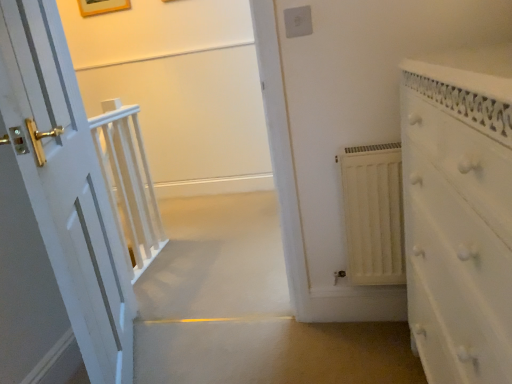
What is the approximate width of wooden picture frame at upper center?

The width of wooden picture frame at upper center is 0.99 inches.

Identify the location of white matte radiator at center right. Image resolution: width=512 pixels, height=384 pixels. (373, 214).

Looking at this image, from a real-world perspective, which is physically below, white matte radiator at center right or white plastic electric outlet at upper center?

In real-world perspective, white matte radiator at center right is lower.

Is white matte radiator at center right positioned behind white plastic electric outlet at upper center?

That is False.

Does point (357, 201) come farther from viewer compared to point (291, 21)?

Yes, it is behind point (291, 21).

In terms of size, does white matte radiator at center right appear bigger or smaller than white plastic electric outlet at upper center?

Clearly, white matte radiator at center right is larger in size than white plastic electric outlet at upper center.

Looking at the image, does white textured dresser at right seem bigger or smaller compared to white matte radiator at center right?

white textured dresser at right is bigger than white matte radiator at center right.

Is white textured dresser at right next to white matte radiator at center right and touching it?

No, white textured dresser at right is not with white matte radiator at center right.

Considering the positions of point (470, 272) and point (370, 188), is point (470, 272) closer or farther from the camera than point (370, 188)?

Clearly, point (470, 272) is closer to the camera than point (370, 188).

How different are the orientations of white textured dresser at right and white matte radiator at center right in degrees?

The facing directions of white textured dresser at right and white matte radiator at center right are 90.9 degrees apart.

Is white plastic electric outlet at upper center located outside white matte radiator at center right?

Indeed, white plastic electric outlet at upper center is completely outside white matte radiator at center right.

Relative to white matte radiator at center right, is white plastic electric outlet at upper center in front or behind?

Visually, white plastic electric outlet at upper center is located behind white matte radiator at center right.

Is white plastic electric outlet at upper center not near white matte radiator at center right?

No, white plastic electric outlet at upper center is in close proximity to white matte radiator at center right.

Who is taller, white plastic electric outlet at upper center or white matte radiator at center right?

white matte radiator at center right is taller.

Would you consider white textured dresser at right to be distant from white plastic electric outlet at upper center?

No, there isn't a large distance between white textured dresser at right and white plastic electric outlet at upper center.

Considering the positions of points (459, 189) and (303, 29), is point (459, 189) closer to camera compared to point (303, 29)?

Yes, it is in front of point (303, 29).

Is white textured dresser at right turned away from white plastic electric outlet at upper center?

white textured dresser at right is not turned away from white plastic electric outlet at upper center.

From a real-world perspective, between white wooden balustrade at center and white plastic electric outlet at upper center, who is vertically higher?

In real-world perspective, white plastic electric outlet at upper center is above.

Between white wooden balustrade at center and white plastic electric outlet at upper center, which one has larger size?

white wooden balustrade at center.

Where is `electric outlet that is in front of the white wooden balustrade at center`? This screenshot has width=512, height=384. electric outlet that is in front of the white wooden balustrade at center is located at coordinates (298, 21).

Considering their positions, is white wooden balustrade at center located in front of or behind white plastic electric outlet at upper center?

white wooden balustrade at center is behind white plastic electric outlet at upper center.

Image resolution: width=512 pixels, height=384 pixels. In order to click on balustrade behind the white matte radiator at center right in this screenshot , I will do `click(128, 182)`.

Between white matte radiator at center right and white wooden balustrade at center, which one has smaller size?

white matte radiator at center right.

Can you confirm if white matte radiator at center right is positioned to the right of white wooden balustrade at center?

Correct, you'll find white matte radiator at center right to the right of white wooden balustrade at center.

Is the depth of white matte radiator at center right less than that of white wooden balustrade at center?

Yes, white matte radiator at center right is closer to the viewer.

Is point (123, 183) positioned behind point (366, 234)?

Yes, point (123, 183) is behind point (366, 234).

Does white wooden balustrade at center have a greater height compared to white matte radiator at center right?

Correct, white wooden balustrade at center is much taller as white matte radiator at center right.

Who is smaller, white wooden balustrade at center or white matte radiator at center right?

white matte radiator at center right is smaller.

Is white wooden balustrade at center placed right next to white matte radiator at center right?

white wooden balustrade at center is not next to white matte radiator at center right, and they're not touching.

The height and width of the screenshot is (384, 512). I want to click on radiator below the white plastic electric outlet at upper center (from the image's perspective), so click(373, 214).

Where is `radiator that appears above the white textured dresser at right (from the image's perspective)`? radiator that appears above the white textured dresser at right (from the image's perspective) is located at coordinates (373, 214).

Looking at the image, which one is located further to white plastic electric outlet at upper center, white textured dresser at right or white matte radiator at center right?

Based on the image, white textured dresser at right appears to be further to white plastic electric outlet at upper center.

When comparing their distances from white matte radiator at center right, does white plastic electric outlet at upper center or white wooden balustrade at center seem further?

white wooden balustrade at center is further to white matte radiator at center right.

Looking at the image, which one is located closer to wooden picture frame at upper center, white textured dresser at right or white plastic electric outlet at upper center?

white plastic electric outlet at upper center.

Based on their spatial positions, is white matte radiator at center right or white wooden balustrade at center closer to white textured dresser at right?

Based on the image, white matte radiator at center right appears to be nearer to white textured dresser at right.

Considering their positions, is white textured dresser at right positioned further to wooden picture frame at upper center than white matte radiator at center right?

white textured dresser at right is positioned further to the anchor wooden picture frame at upper center.

Which object lies further to the anchor point white matte radiator at center right, white textured dresser at right or white wooden balustrade at center?

Among the two, white wooden balustrade at center is located further to white matte radiator at center right.

Based on their spatial positions, is wooden picture frame at upper center or white textured dresser at right closer to white plastic electric outlet at upper center?

The object closer to white plastic electric outlet at upper center is white textured dresser at right.

Which object lies nearer to the anchor point white wooden balustrade at center, white matte radiator at center right or white textured dresser at right?

Among the two, white matte radiator at center right is located nearer to white wooden balustrade at center.

The image size is (512, 384). Find the location of `electric outlet between white textured dresser at right and white wooden balustrade at center along the z-axis`. electric outlet between white textured dresser at right and white wooden balustrade at center along the z-axis is located at coordinates (298, 21).

You are a GUI agent. You are given a task and a screenshot of the screen. Output one action in this format:
    pyautogui.click(x=<x>, y=<y>)
    Task: Click on the balustrade that lies between wooden picture frame at upper center and white matte radiator at center right from top to bottom
    The height and width of the screenshot is (384, 512).
    Given the screenshot: What is the action you would take?
    pyautogui.click(x=128, y=182)

The height and width of the screenshot is (384, 512). I want to click on electric outlet between white textured dresser at right and wooden picture frame at upper center in the front-back direction, so click(x=298, y=21).

Identify the location of radiator between white textured dresser at right and white plastic electric outlet at upper center from front to back. The width and height of the screenshot is (512, 384). (373, 214).